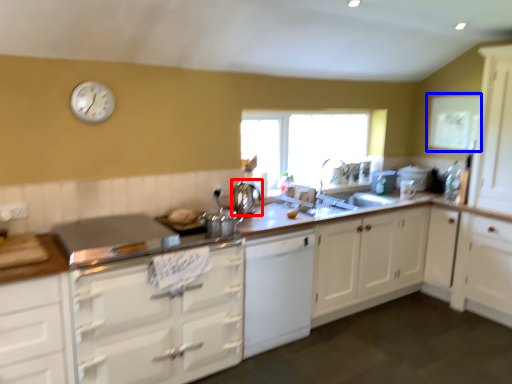
Question: Which of the following is the closest to the observer, kitchen appliance (highlighted by a red box) or window screen (highlighted by a blue box)?

Choices:
 (A) kitchen appliance
 (B) window screen

Answer: (A)